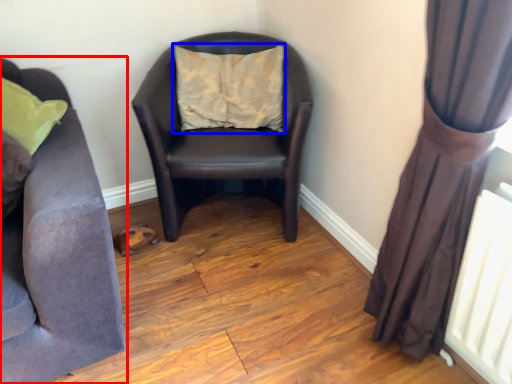
Question: Which point is closer to the camera, studio couch (highlighted by a red box) or pillow (highlighted by a blue box)?

Choices:
 (A) studio couch
 (B) pillow

Answer: (A)